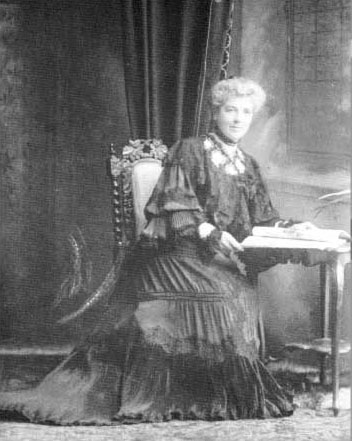
Locate an element on the screen. The width and height of the screenshot is (352, 441). chair is located at coordinates (136, 190).